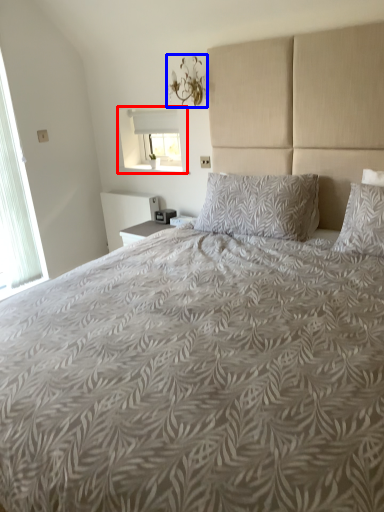
Question: Which object is closer to the camera taking this photo, window (highlighted by a red box) or light fixture (highlighted by a blue box)?

Choices:
 (A) window
 (B) light fixture

Answer: (B)